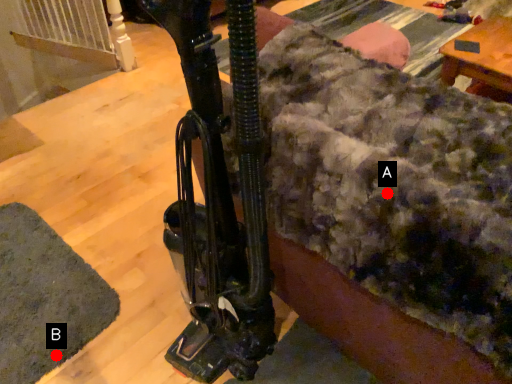
Question: Two points are circled on the image, labeled by A and B beside each circle. Which point is farther to the camera?

Choices:
 (A) A is further
 (B) B is further

Answer: (B)